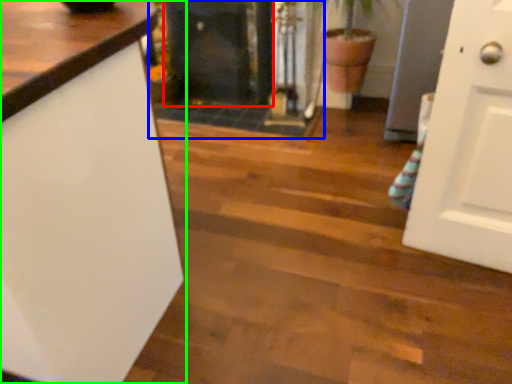
Question: Estimate the real-world distances between objects in this image. Which object is farther from fireplace (highlighted by a red box), fireplace (highlighted by a blue box) or countertop (highlighted by a green box)?

Choices:
 (A) fireplace
 (B) countertop

Answer: (B)